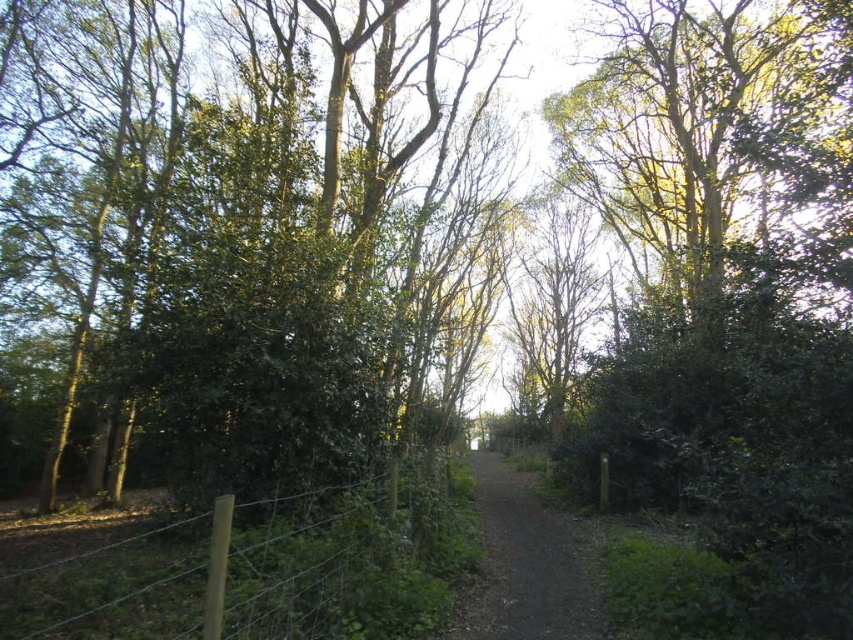
Question: From the image, what is the correct spatial relationship of wooden post at lower left in relation to dirt/gravel path at center?

Choices:
 (A) right
 (B) left

Answer: (B)

Question: Does wooden post at lower left appear on the left side of dirt/gravel path at center?

Choices:
 (A) yes
 (B) no

Answer: (A)

Question: Which of the following is the closest to the observer?

Choices:
 (A) (126, 541)
 (B) (590, 573)

Answer: (B)

Question: Can you confirm if wooden post at lower left is thinner than dirt/gravel path at center?

Choices:
 (A) no
 (B) yes

Answer: (B)

Question: Which object appears closest to the camera in this image?

Choices:
 (A) wooden post at lower left
 (B) dirt/gravel path at center

Answer: (B)